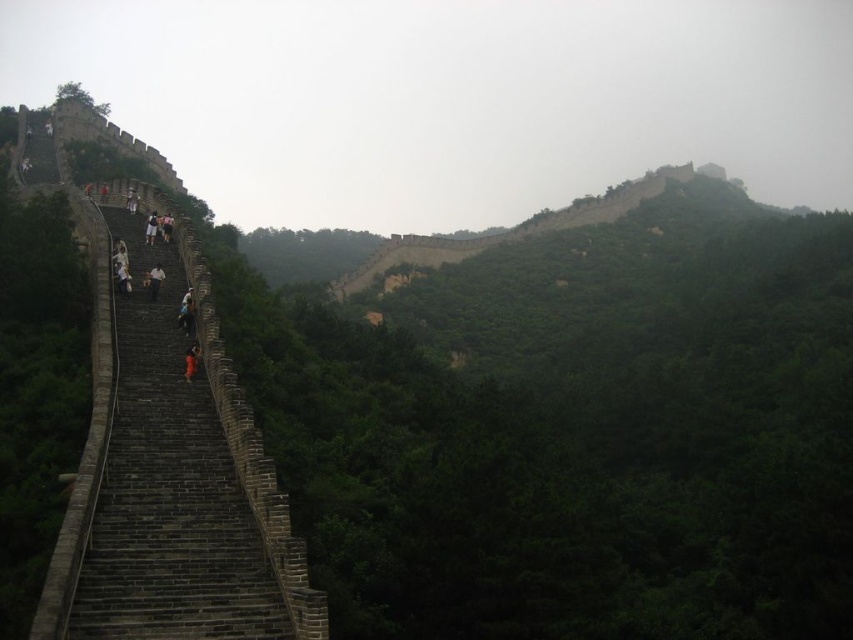
Is dark gray stone stairs at left thinner than dark gray stone person at center-left?

In fact, dark gray stone stairs at left might be wider than dark gray stone person at center-left.

Who is more forward, (115, 502) or (152, 276)?

Point (115, 502) is more forward.

Between point (148, 522) and point (146, 282), which one is positioned behind?

Positioned behind is point (146, 282).

Where is `dark gray stone stairs at left`? The image size is (853, 640). dark gray stone stairs at left is located at coordinates (170, 477).

Does dark gray stone stairs at left have a smaller size compared to orange fabric person at left?

No, dark gray stone stairs at left is not smaller than orange fabric person at left.

Who is more forward, (67, 620) or (189, 353)?

Point (67, 620) is in front.

Is point (189, 404) more distant than point (184, 362)?

No, it is not.

Identify the location of dark gray stone stairs at left. The width and height of the screenshot is (853, 640). (170, 477).

Does light brown wooden stick at upper left have a lesser width compared to dark gray stone person at center-left?

In fact, light brown wooden stick at upper left might be wider than dark gray stone person at center-left.

Consider the image. Is light brown wooden stick at upper left above dark gray stone person at center-left?

Correct, light brown wooden stick at upper left is located above dark gray stone person at center-left.

Measure the distance between point (x=119, y=291) and camera.

Point (x=119, y=291) is 65.04 meters away from camera.

Locate an element on the screen. This screenshot has width=853, height=640. light brown wooden stick at upper left is located at coordinates (122, 276).